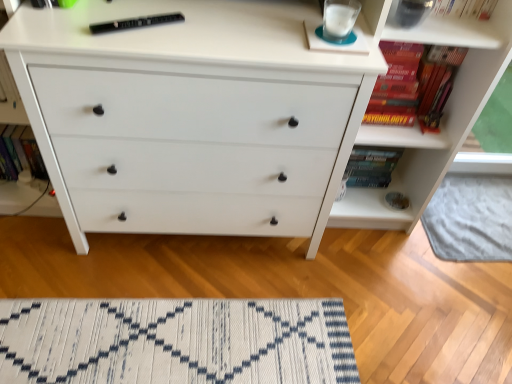
Question: Is black plastic remote at upper center, the third book viewed from the right, smaller than white matte chest of drawers at center?

Choices:
 (A) yes
 (B) no

Answer: (A)

Question: Can you confirm if black plastic remote at upper center, placed as the second book when sorted from left to right, is wider than white matte chest of drawers at center?

Choices:
 (A) no
 (B) yes

Answer: (A)

Question: From the image's perspective, does black plastic remote at upper center, the third book viewed from the right, appear lower than white matte chest of drawers at center?

Choices:
 (A) no
 (B) yes

Answer: (A)

Question: Is black plastic remote at upper center, placed as the second book when sorted from left to right, bigger than white matte chest of drawers at center?

Choices:
 (A) yes
 (B) no

Answer: (B)

Question: Does black plastic remote at upper center, the third book viewed from the right, have a greater height compared to white matte chest of drawers at center?

Choices:
 (A) no
 (B) yes

Answer: (A)

Question: In terms of width, does hardcover book at left, marked as the 4th book in a right-to-left arrangement, look wider or thinner when compared to hardcover book at upper right, acting as the 4th book starting from the left?

Choices:
 (A) thin
 (B) wide

Answer: (A)

Question: Is hardcover book at left, acting as the first book starting from the left, in front of or behind hardcover book at upper right, acting as the 4th book starting from the left, in the image?

Choices:
 (A) behind
 (B) front

Answer: (A)

Question: In the image, is hardcover book at left, marked as the 4th book in a right-to-left arrangement, on the left side or the right side of hardcover book at upper right, positioned as the 1th book in right-to-left order?

Choices:
 (A) left
 (B) right

Answer: (A)

Question: Is hardcover book at left, marked as the 4th book in a right-to-left arrangement, taller or shorter than hardcover book at upper right, positioned as the 1th book in right-to-left order?

Choices:
 (A) tall
 (B) short

Answer: (B)

Question: Would you say white woven mat at lower center is to the left or to the right of white textured rug at lower center in the picture?

Choices:
 (A) left
 (B) right

Answer: (A)

Question: From the image's perspective, is white woven mat at lower center positioned above or below white textured rug at lower center?

Choices:
 (A) below
 (B) above

Answer: (A)

Question: From their relative heights in the image, would you say white woven mat at lower center is taller or shorter than white textured rug at lower center?

Choices:
 (A) short
 (B) tall

Answer: (B)

Question: Is white woven mat at lower center spatially inside white textured rug at lower center, or outside of it?

Choices:
 (A) outside
 (B) inside

Answer: (A)

Question: From a real-world perspective, relative to hardcover book at upper right, acting as the 4th book starting from the left, is white textured rug at lower center vertically above or below?

Choices:
 (A) above
 (B) below

Answer: (B)

Question: Is point (437, 233) closer or farther from the camera than point (396, 64)?

Choices:
 (A) farther
 (B) closer

Answer: (A)